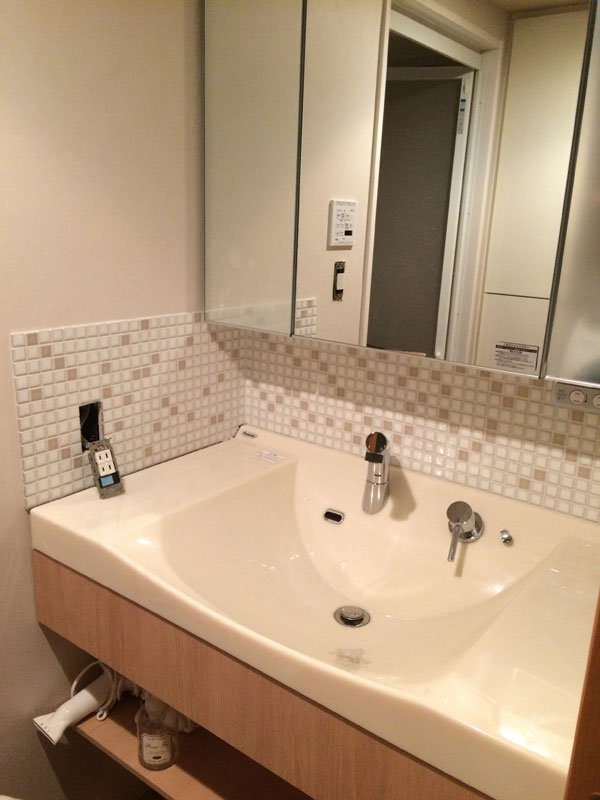
This screenshot has width=600, height=800. What are the coordinates of `dresser` in the screenshot? It's located at (85, 702).